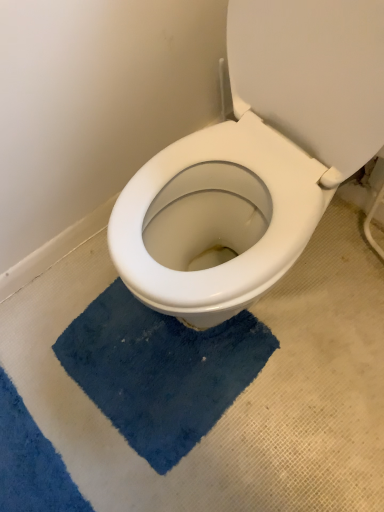
This screenshot has height=512, width=384. In order to click on vacant space situated on the left part of blue plush bath mat at center in this screenshot , I will do `click(44, 394)`.